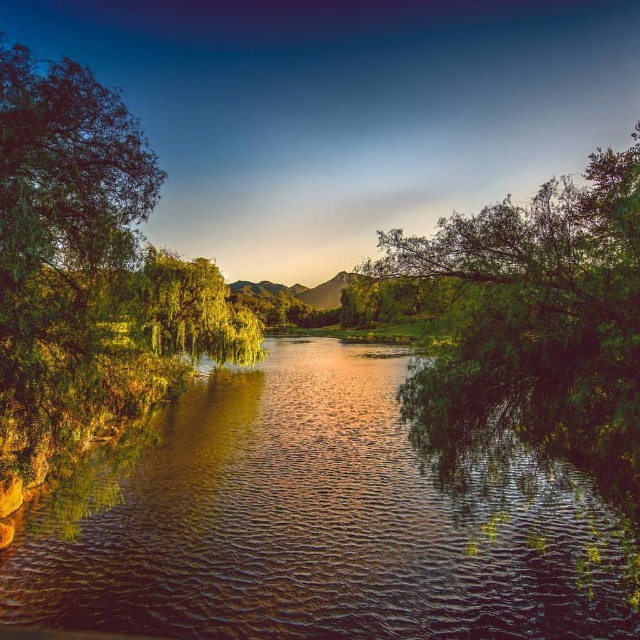
You are a photographer planning to capture the landscape scene described. You want to ensure both the shiny reflective water at center and the green leafy tree at left are visible in your shot. Based on their sizes in the image, which object should you prioritize framing closer to the center of your composition?

The green leafy tree at left occupies more space in the image than the shiny reflective water at center, so you should prioritize framing the green leafy tree at left closer to the center of your composition to ensure it is prominently featured.

You are a photographer planning to take a landscape photo of the shiny reflective water at center and the green leafy tree at right. Which object will appear smaller in the photo?

The shiny reflective water at center will appear smaller because it is not as tall as the green leafy tree at right.